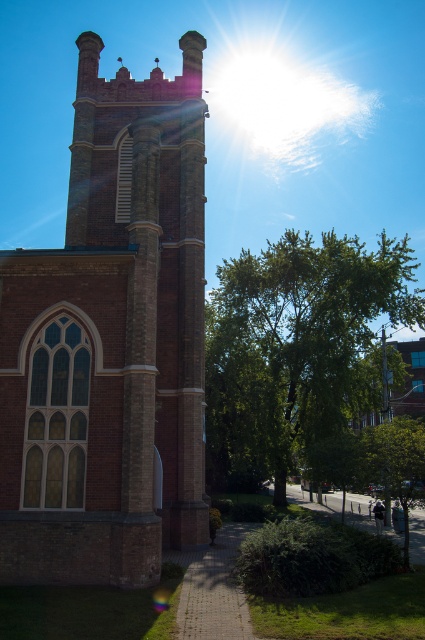
Does brick tower at left have a greater height compared to green leafy tree at center?

Incorrect, brick tower at left's height is not larger of green leafy tree at center's.

Is point (96, 438) farther from camera compared to point (206, 417)?

That is False.

Between point (150, 332) and point (243, 401), which one is positioned in front?

Point (150, 332) is in front.

Find the location of a particular element. brick tower at left is located at coordinates (110, 342).